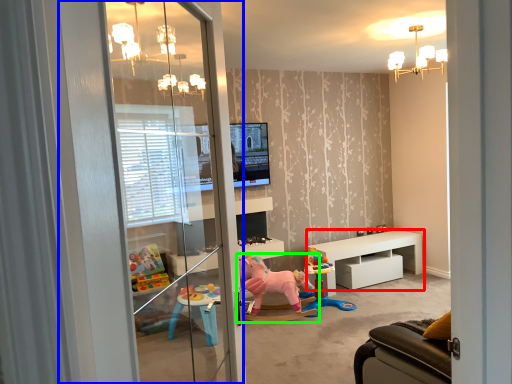
Question: Considering the real-world distances, which object is farthest from table (highlighted by a red box)? screen door (highlighted by a blue box) or toy (highlighted by a green box)?

Choices:
 (A) screen door
 (B) toy

Answer: (A)